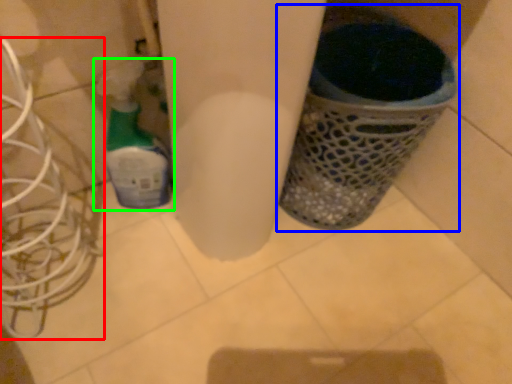
Question: Considering the real-world distances, which object is farthest from wire (highlighted by a red box)? waste container (highlighted by a blue box) or bottle (highlighted by a green box)?

Choices:
 (A) waste container
 (B) bottle

Answer: (A)